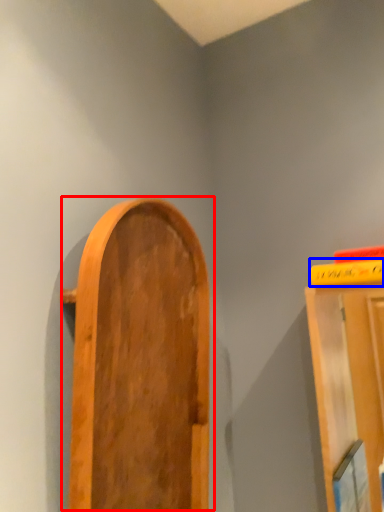
Question: Among these objects, which one is nearest to the camera, door (highlighted by a red box) or book (highlighted by a blue box)?

Choices:
 (A) door
 (B) book

Answer: (A)